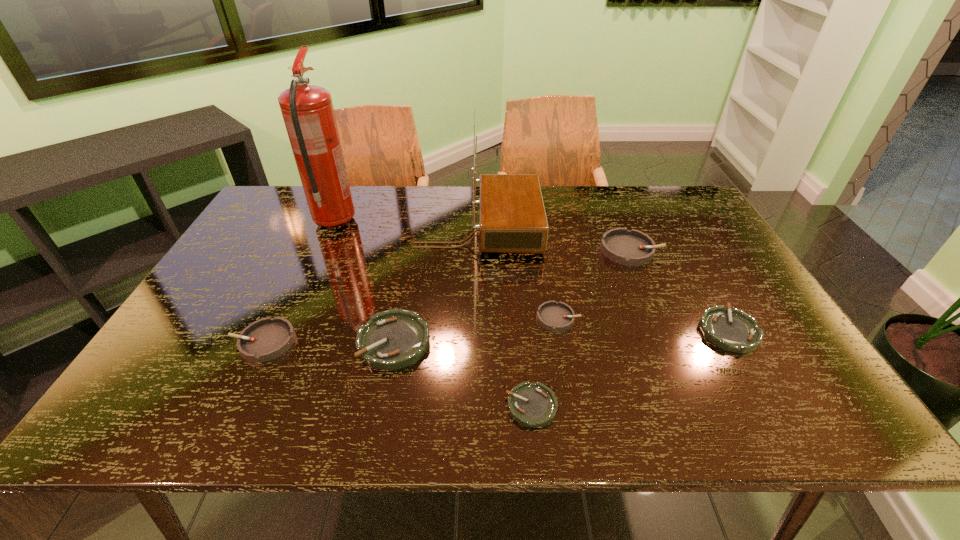
Where is `vacant space that satisfies the following two spatial constraints: 1. on the back side of the nearest ashtray; 2. on the right side of the second gray ashtray from right to left`? Image resolution: width=960 pixels, height=540 pixels. vacant space that satisfies the following two spatial constraints: 1. on the back side of the nearest ashtray; 2. on the right side of the second gray ashtray from right to left is located at coordinates (522, 318).